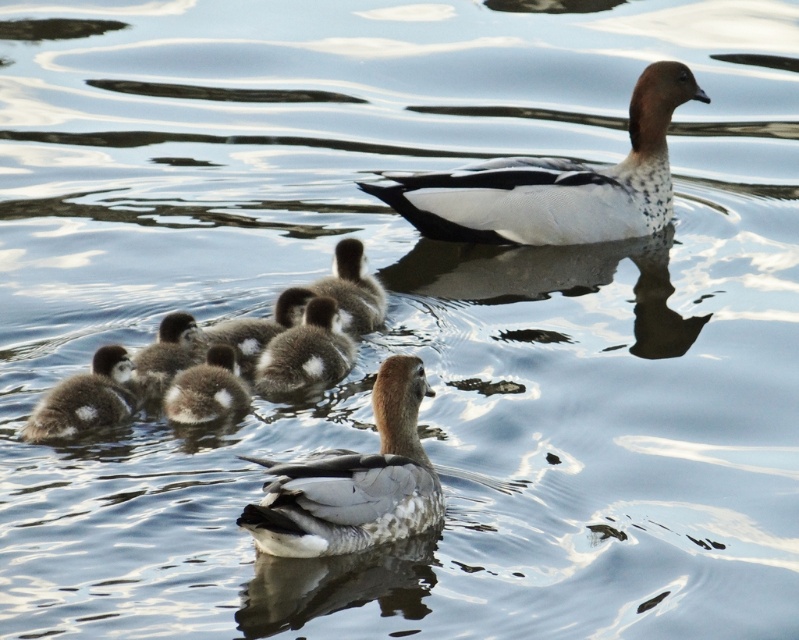
Does white speckled feathers at upper right have a lesser height compared to brown fuzzy duckling at lower center?

Incorrect, white speckled feathers at upper right's height does not fall short of brown fuzzy duckling at lower center's.

In the scene shown: Is white speckled feathers at upper right to the right of brown fuzzy duckling at lower center from the viewer's perspective?

Indeed, white speckled feathers at upper right is positioned on the right side of brown fuzzy duckling at lower center.

The height and width of the screenshot is (640, 799). In order to click on white speckled feathers at upper right in this screenshot , I will do `click(555, 182)`.

This screenshot has width=799, height=640. What are the coordinates of `white speckled feathers at upper right` in the screenshot? It's located at (555, 182).

Who is positioned more to the right, brown fluffy duckling at center or brown fuzzy duckling at lower center?

brown fluffy duckling at center

Which is in front, point (287, 339) or point (240, 410)?

Point (240, 410) is more forward.

Locate an element on the screen. This screenshot has height=640, width=799. brown fluffy duckling at center is located at coordinates (305, 353).

Between speckled downy duckling at lower left and brown fuzzy duckling at lower center, which one appears on the left side from the viewer's perspective?

speckled downy duckling at lower left is more to the left.

Is point (48, 390) farther from viewer compared to point (227, 403)?

Yes, point (48, 390) is farther from viewer.

The image size is (799, 640). I want to click on speckled downy duckling at lower left, so pos(85,397).